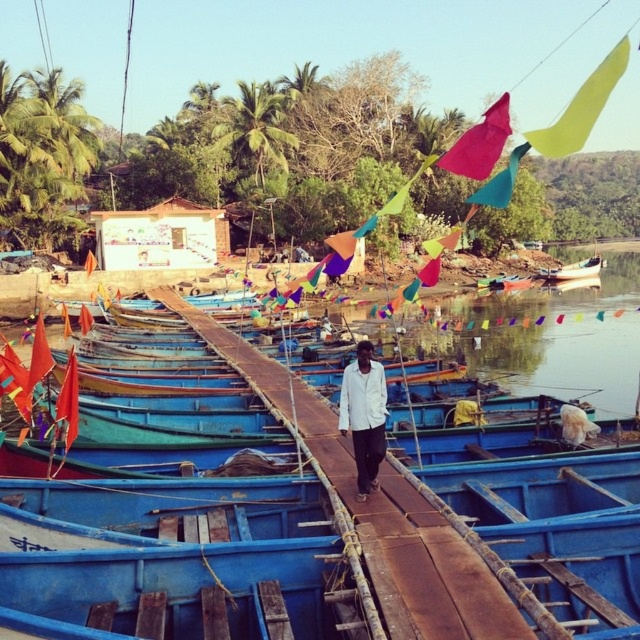
You are standing on the wooden walkway in the fishing village and notice the rusty wood dock at center and the white glossy boat at right. Which object is positioned lower in the scene?

The rusty wood dock at center is below the white glossy boat at right, so it is positioned lower in the scene.

You are planning to walk across the rusty wood dock at center and the white glossy boat at right. Which one has a narrower width?

The rusty wood dock at center is narrower than the white glossy boat at right because its width is less than that of the white glossy boat at right.

You are a visitor at the harbor and want to take a photo of the rusty wood dock at center and the white glossy boat at right. Which object should you focus on first if you want to capture both in one frame without moving your camera?

You should focus on the rusty wood dock at center first because it is shorter than the white glossy boat at right, allowing both to be in frame without adjusting the camera angle.